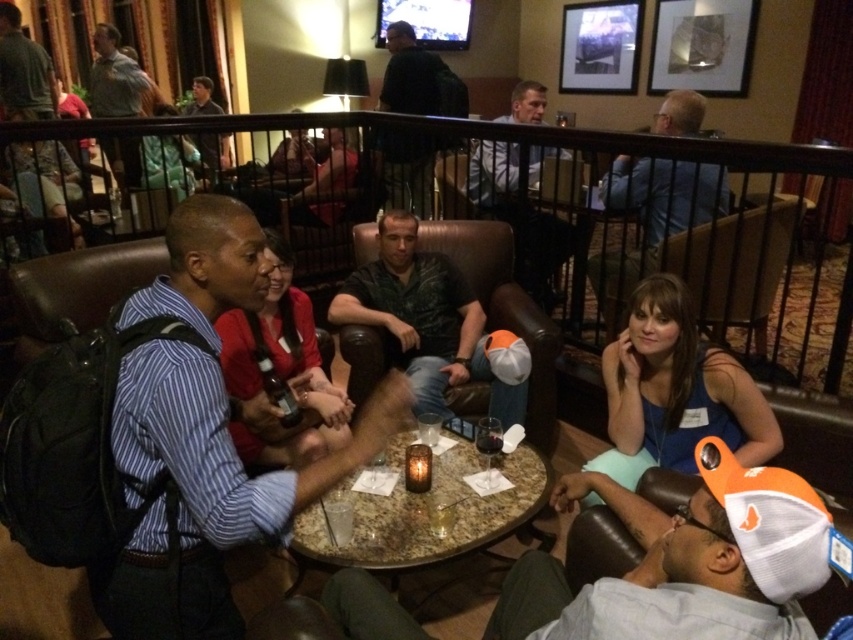
Can you confirm if light gray shirt at upper left is wider than translucent glass at table center?

Yes.

Between point (131, 74) and point (490, 445), which one is positioned in front?

Positioned in front is point (490, 445).

Where is `light gray shirt at upper left`? light gray shirt at upper left is located at coordinates (114, 77).

Does light blue shirt at upper center have a greater width compared to matte black shirt at upper left?

Yes, light blue shirt at upper center is wider than matte black shirt at upper left.

Is light blue shirt at upper center smaller than matte black shirt at upper left?

No.

Describe the element at coordinates (519, 218) in the screenshot. The height and width of the screenshot is (640, 853). I see `light blue shirt at upper center` at that location.

You are a GUI agent. You are given a task and a screenshot of the screen. Output one action in this format:
    pyautogui.click(x=<x>, y=<y>)
    Task: Click on the light blue shirt at upper center
    This screenshot has height=640, width=853.
    Given the screenshot: What is the action you would take?
    pyautogui.click(x=519, y=218)

Does light gray shirt at upper left come behind dark green shirt at upper left?

Yes, light gray shirt at upper left is further from the viewer.

Does point (132, 170) lie behind point (28, 74)?

Yes.

Which is in front, point (114, 29) or point (39, 76)?

Positioned in front is point (39, 76).

At what (x,y) coordinates should I click in order to perform the action: click on light gray shirt at upper left. Please return your answer as a coordinate pair (x, y). This screenshot has height=640, width=853. Looking at the image, I should click on (114, 77).